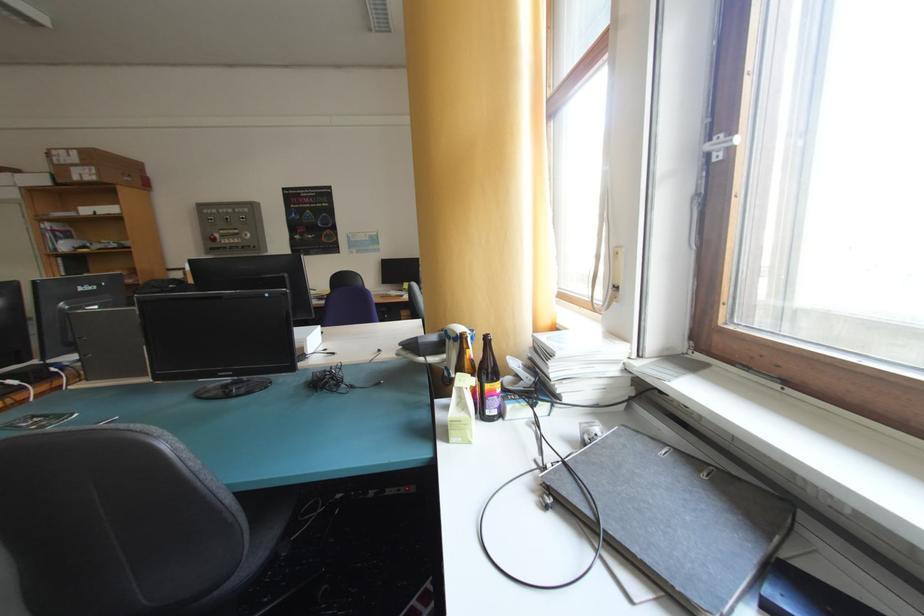
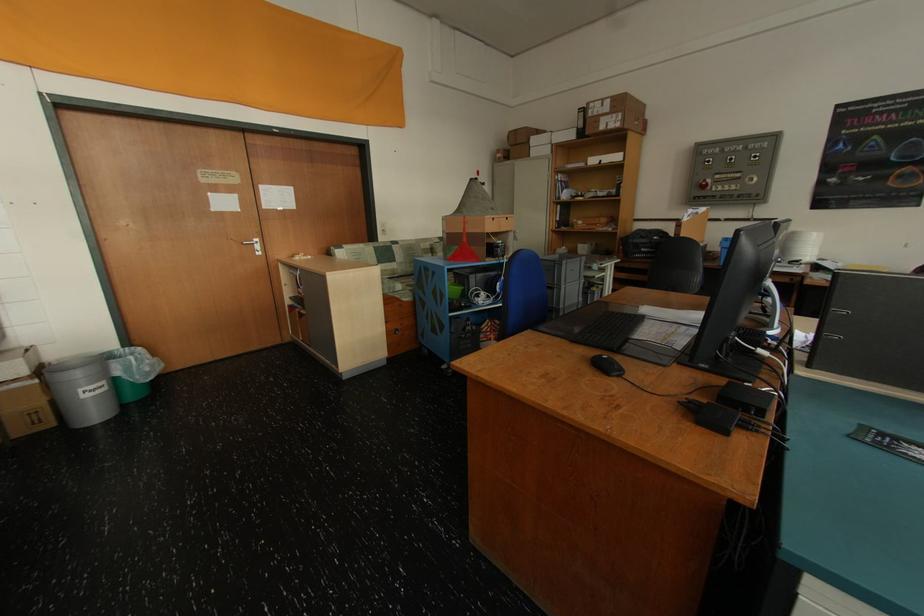
Where in the second image is the point corresponding to pixel 103 171 from the first image?

(628, 118)